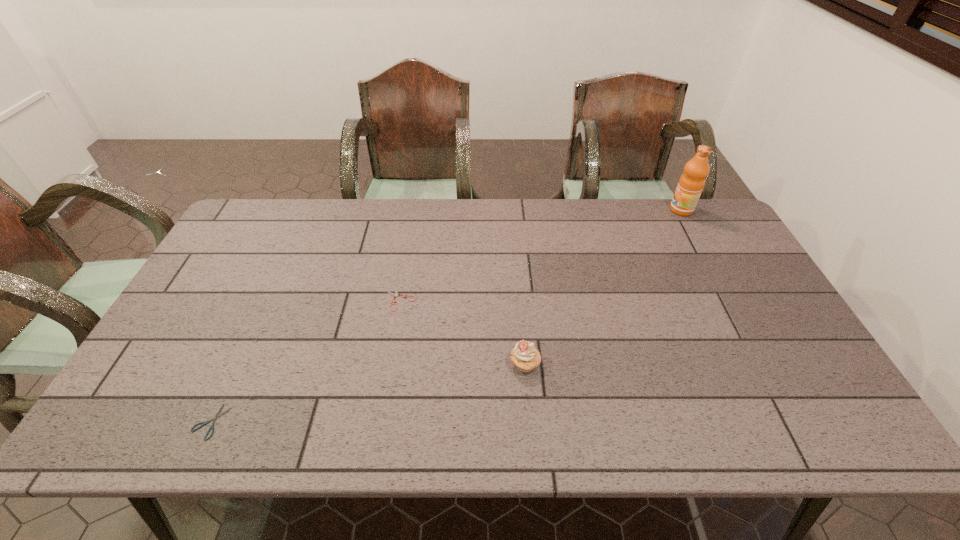
Find the location of a particular element. The width and height of the screenshot is (960, 540). fruit juice is located at coordinates (691, 183).

Find the location of `the tallest object`. the tallest object is located at coordinates (691, 183).

Where is `the second nearest object`? Image resolution: width=960 pixels, height=540 pixels. the second nearest object is located at coordinates (525, 357).

This screenshot has height=540, width=960. What are the coordinates of `the second tallest object` in the screenshot? It's located at (525, 357).

Image resolution: width=960 pixels, height=540 pixels. Identify the location of the third nearest object. (395, 295).

Where is `the second object from left to right`? Image resolution: width=960 pixels, height=540 pixels. the second object from left to right is located at coordinates (395, 295).

This screenshot has height=540, width=960. What are the coordinates of `the leftmost object` in the screenshot? It's located at (217, 415).

Find the location of `the nearer shears`. the nearer shears is located at coordinates (217, 415).

Image resolution: width=960 pixels, height=540 pixels. I want to click on free space located on the label side of the rightmost object, so pyautogui.click(x=563, y=210).

This screenshot has height=540, width=960. In order to click on vacant space located 0.120m on the label side of the rightmost object in this screenshot , I will do `click(636, 210)`.